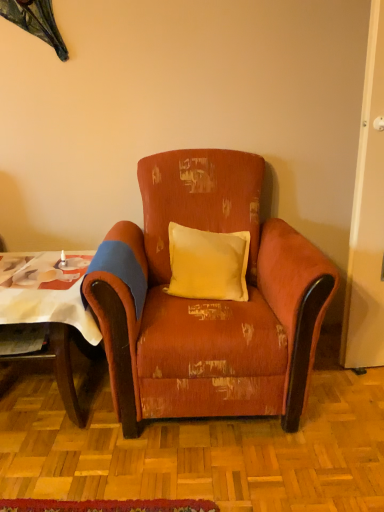
Question: Is yellow fabric pillow at center wider than wooden table at left?

Choices:
 (A) yes
 (B) no

Answer: (B)

Question: Is yellow fabric pillow at center smaller than wooden table at left?

Choices:
 (A) no
 (B) yes

Answer: (B)

Question: From the image's perspective, is yellow fabric pillow at center on wooden table at left?

Choices:
 (A) no
 (B) yes

Answer: (B)

Question: Is yellow fabric pillow at center not close to wooden table at left?

Choices:
 (A) no
 (B) yes

Answer: (A)

Question: From the image's perspective, is yellow fabric pillow at center beneath wooden table at left?

Choices:
 (A) yes
 (B) no

Answer: (B)

Question: Do you think wooden table at left is within yellow fabric pillow at center, or outside of it?

Choices:
 (A) inside
 (B) outside

Answer: (B)

Question: In the image, is wooden table at left positioned in front of or behind yellow fabric pillow at center?

Choices:
 (A) front
 (B) behind

Answer: (A)

Question: From a real-world perspective, is wooden table at left positioned above or below yellow fabric pillow at center?

Choices:
 (A) below
 (B) above

Answer: (A)

Question: Considering the relative positions of wooden table at left and yellow fabric pillow at center in the image provided, is wooden table at left to the left or to the right of yellow fabric pillow at center?

Choices:
 (A) right
 (B) left

Answer: (B)

Question: Visually, is distressed orange fabric armchair at center positioned to the left or to the right of yellow fabric pillow at center?

Choices:
 (A) left
 (B) right

Answer: (A)

Question: From a real-world perspective, is distressed orange fabric armchair at center above or below yellow fabric pillow at center?

Choices:
 (A) below
 (B) above

Answer: (A)

Question: From the image's perspective, is distressed orange fabric armchair at center above or below yellow fabric pillow at center?

Choices:
 (A) below
 (B) above

Answer: (A)

Question: In terms of width, does distressed orange fabric armchair at center look wider or thinner when compared to yellow fabric pillow at center?

Choices:
 (A) wide
 (B) thin

Answer: (A)

Question: From a real-world perspective, is distressed orange fabric armchair at center above or below wooden table at left?

Choices:
 (A) below
 (B) above

Answer: (B)

Question: In terms of height, does distressed orange fabric armchair at center look taller or shorter compared to wooden table at left?

Choices:
 (A) tall
 (B) short

Answer: (A)